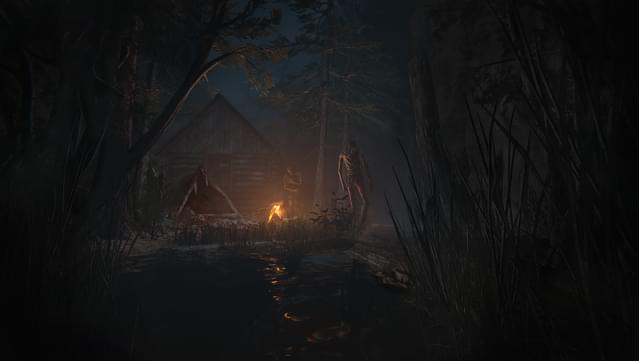
I want to click on door, so click(x=220, y=173).